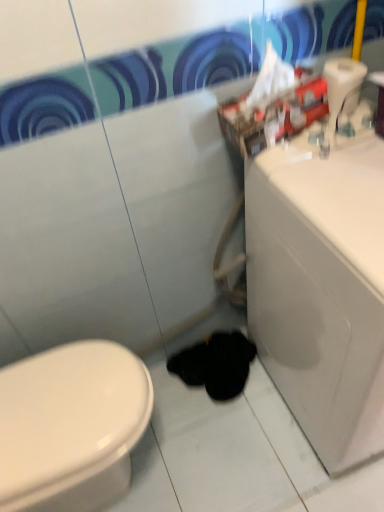
Question: Is the depth of white glossy sink at right less than that of black fuzzy animal at lower center?

Choices:
 (A) no
 (B) yes

Answer: (B)

Question: Is white glossy sink at right taller than black fuzzy animal at lower center?

Choices:
 (A) no
 (B) yes

Answer: (B)

Question: Is white glossy sink at right not close to black fuzzy animal at lower center?

Choices:
 (A) no
 (B) yes

Answer: (A)

Question: From a real-world perspective, is white glossy sink at right physically below black fuzzy animal at lower center?

Choices:
 (A) yes
 (B) no

Answer: (B)

Question: Is white glossy sink at right to the right of black fuzzy animal at lower center from the viewer's perspective?

Choices:
 (A) yes
 (B) no

Answer: (A)

Question: From the image's perspective, relative to black fuzzy animal at lower center, is white plastic toilet paper at upper right above or below?

Choices:
 (A) above
 (B) below

Answer: (A)

Question: In terms of height, does white plastic toilet paper at upper right look taller or shorter compared to black fuzzy animal at lower center?

Choices:
 (A) short
 (B) tall

Answer: (B)

Question: In terms of width, does white plastic toilet paper at upper right look wider or thinner when compared to black fuzzy animal at lower center?

Choices:
 (A) wide
 (B) thin

Answer: (B)

Question: From a real-world perspective, is white plastic toilet paper at upper right above or below black fuzzy animal at lower center?

Choices:
 (A) above
 (B) below

Answer: (A)

Question: Relative to black fuzzy animal at lower center, is white glossy sink at right in front or behind?

Choices:
 (A) front
 (B) behind

Answer: (A)

Question: From their relative heights in the image, would you say white glossy sink at right is taller or shorter than black fuzzy animal at lower center?

Choices:
 (A) short
 (B) tall

Answer: (B)

Question: From a real-world perspective, is white glossy sink at right above or below black fuzzy animal at lower center?

Choices:
 (A) below
 (B) above

Answer: (B)

Question: Considering the positions of white glossy sink at right and black fuzzy animal at lower center in the image, is white glossy sink at right bigger or smaller than black fuzzy animal at lower center?

Choices:
 (A) big
 (B) small

Answer: (A)

Question: Is black fuzzy animal at lower center situated inside white glossy sink at right or outside?

Choices:
 (A) outside
 (B) inside

Answer: (A)

Question: From the image's perspective, relative to white glossy sink at right, is black fuzzy animal at lower center above or below?

Choices:
 (A) below
 (B) above

Answer: (A)